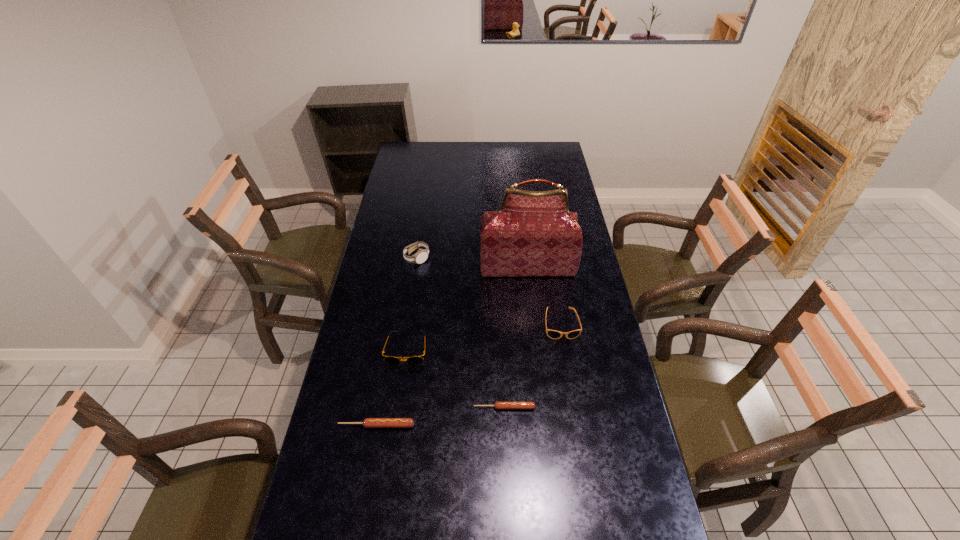
This screenshot has height=540, width=960. In order to click on object that is the second closest one to the right sunglasses in this screenshot , I will do `click(498, 405)`.

This screenshot has width=960, height=540. Identify the location of object that can be found as the closest to the second nearest object. (368, 422).

The width and height of the screenshot is (960, 540). What are the coordinates of `vacant region that satisfies the following two spatial constraints: 1. on the face of the fifth shortest object; 2. on the left side of the shortest object` in the screenshot? It's located at point(395,407).